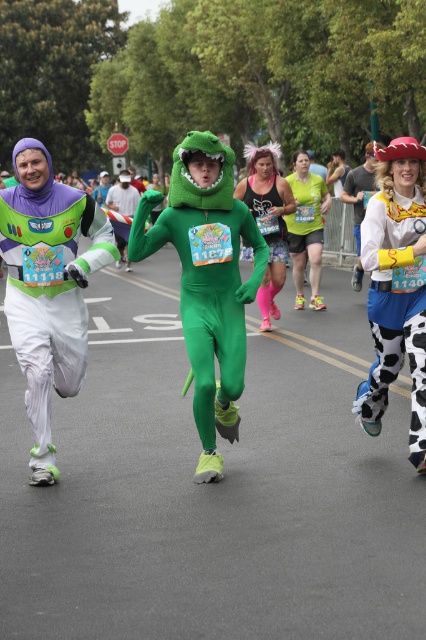
You are a photographer at the running event and want to capture both the matte purple and green costume at left and the neon green spandex at center in a single photo. Based on their positions, which costume should you focus on first to ensure both are in frame?

The matte purple and green costume at left is located below the neon green spandex at center, so you should focus on the neon green spandex at center first to ensure both are in frame.